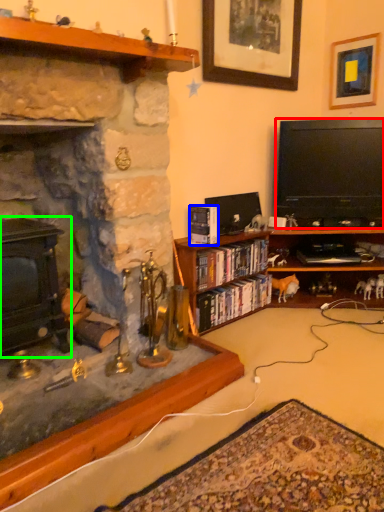
Question: Which is nearer to the television (highlighted by a red box)? book (highlighted by a blue box) or fireplace (highlighted by a green box).

Choices:
 (A) book
 (B) fireplace

Answer: (A)